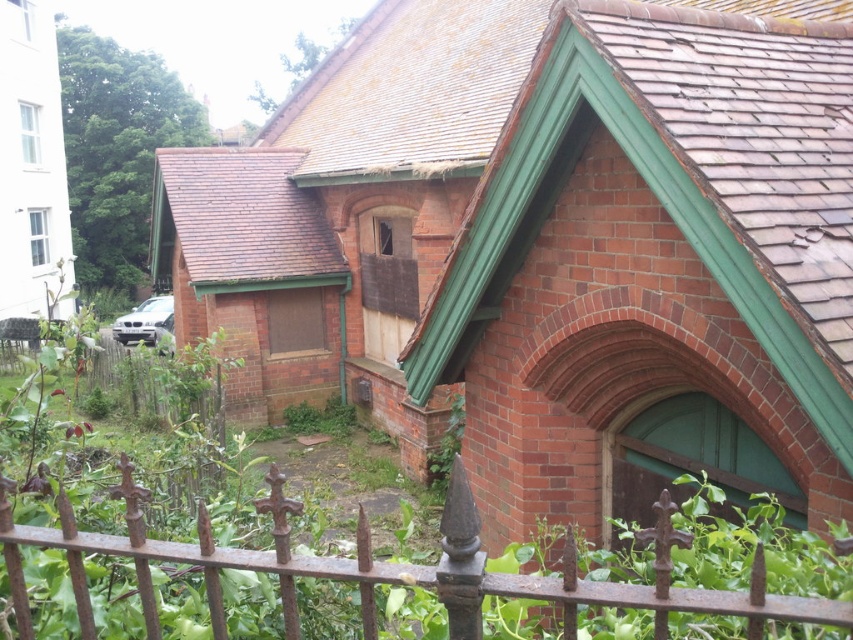
You are an architect inspecting the roof of the brick building. You notice two sections of brown shingles at upper center and brown shingles at upper left. Which section has a greater width?

The brown shingles at upper center has a greater width than the brown shingles at upper left according to the description.

Based on the photo, you are standing in front of a brick building with a steeply pitched roof. You notice a point marked at coordinates (392,568). What object is located at this point?

The point at coordinates (392,568) indicates the rusty iron fence at lower center.

Consider the image. You are standing in front of the brick building and notice a specific point marked at coordinates (x=392, y=568). Based on the scene description, what object is located at that point?

The point at coordinates (x=392, y=568) corresponds to the rusty iron fence at lower center.